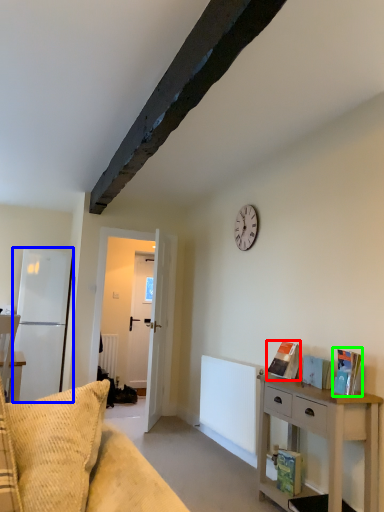
Question: Which object is positioned farthest from book (highlighted by a red box)? Select from fridge (highlighted by a blue box) and book (highlighted by a green box).

Choices:
 (A) fridge
 (B) book

Answer: (A)